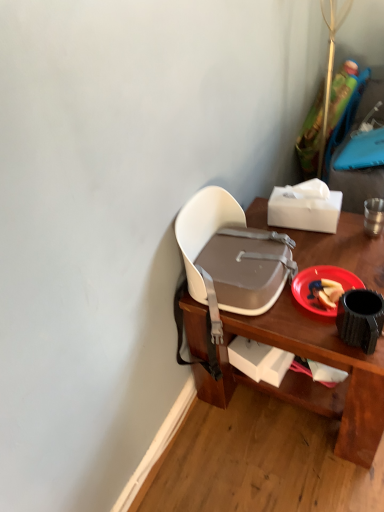
Find the location of a particular element. This screenshot has width=384, height=512. vacant space situated above red plastic plate at lower right (from a real-world perspective) is located at coordinates (323, 285).